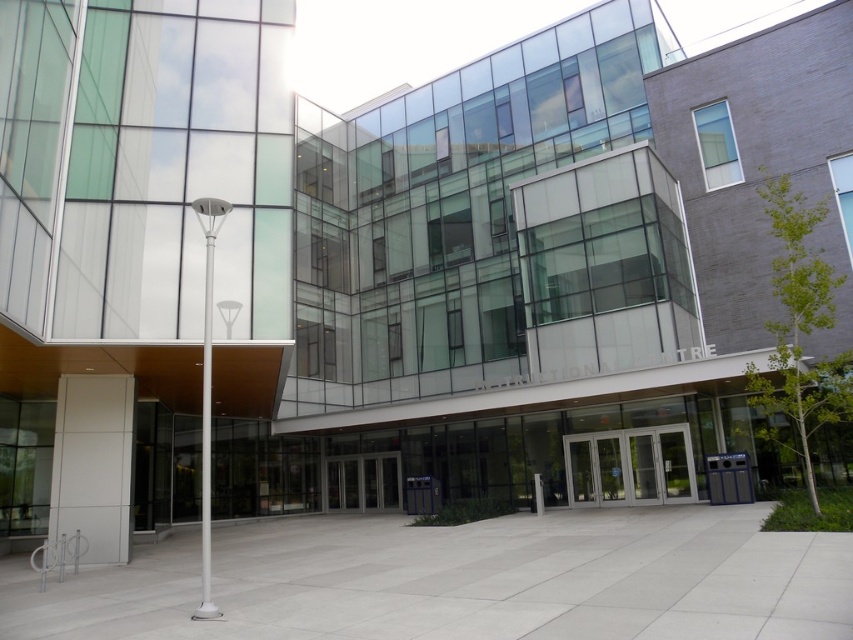
In the scene shown: You are standing in front of the modern building described in the scene. You need to locate the silver metallic doors at center. Based on the 2D coordinates provided, where exactly are the silver metallic doors positioned relative to the building?

The silver metallic doors at center are positioned at the coordinates point (630, 467), which is near the lower central part of the building.

You are standing in front of the modern building and want to enter through the doors. Which of the two doors, the silver metallic doors at center or the metallic glass doors at center, is closer to you?

The silver metallic doors at center is closer to the viewer than the metallic glass doors at center, so the silver metallic doors at center is closer to you.

You are standing in front of the modern building and notice two points marked on the glass facade. The first point is at coordinate point (573,483) and the second is at point (387,493). Which of these two points appears closer to you when looking at the building?

Point (573,483) is closer to the camera than point (387,493), so when looking at the building, the point at (573,483) will appear closer to you.